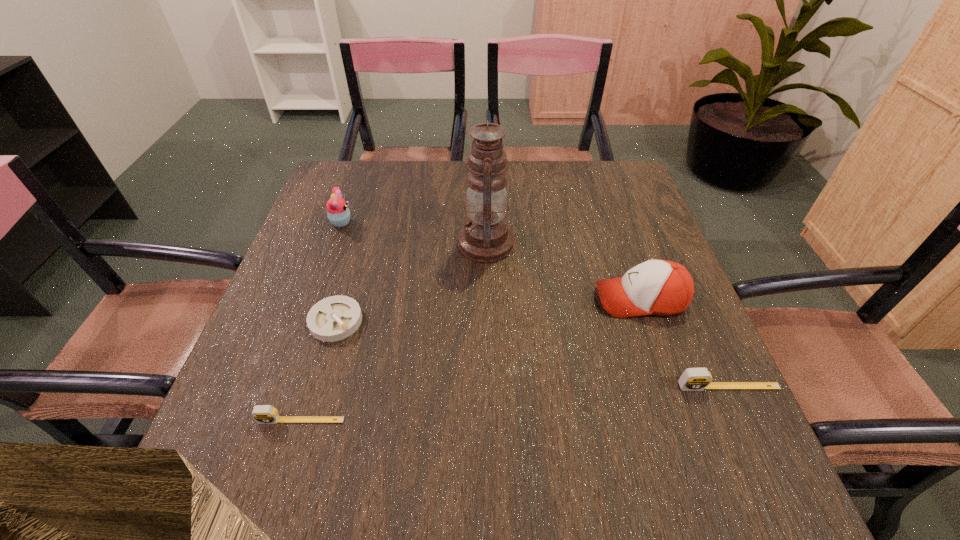
The height and width of the screenshot is (540, 960). What are the coordinates of `vacant space located 0.220m on the left of the oil lamp` in the screenshot? It's located at (371, 243).

At what (x,y) coordinates should I click in order to perform the action: click on vacant space located on the right of the ashtray. Please return your answer as a coordinate pair (x, y). Looking at the image, I should click on (545, 321).

Where is `vacant position located 0.390m on the face of the cupcake`? The image size is (960, 540). vacant position located 0.390m on the face of the cupcake is located at coordinates (498, 222).

Where is `vacant space located 0.090m on the front-facing side of the baseball cap`? Image resolution: width=960 pixels, height=540 pixels. vacant space located 0.090m on the front-facing side of the baseball cap is located at coordinates (555, 299).

I want to click on vacant region located on the front-facing side of the baseball cap, so click(x=496, y=299).

Locate an element on the screen. vacant space situated 0.210m on the front-facing side of the baseball cap is located at coordinates (500, 299).

Image resolution: width=960 pixels, height=540 pixels. Find the location of `object present at the near edge`. object present at the near edge is located at coordinates (263, 414).

Identify the location of tape measure located at the left edge. The height and width of the screenshot is (540, 960). (263, 414).

Locate an element on the screen. The image size is (960, 540). ashtray at the left edge is located at coordinates (334, 318).

Where is `cupcake that is at the left edge`? The width and height of the screenshot is (960, 540). cupcake that is at the left edge is located at coordinates (338, 213).